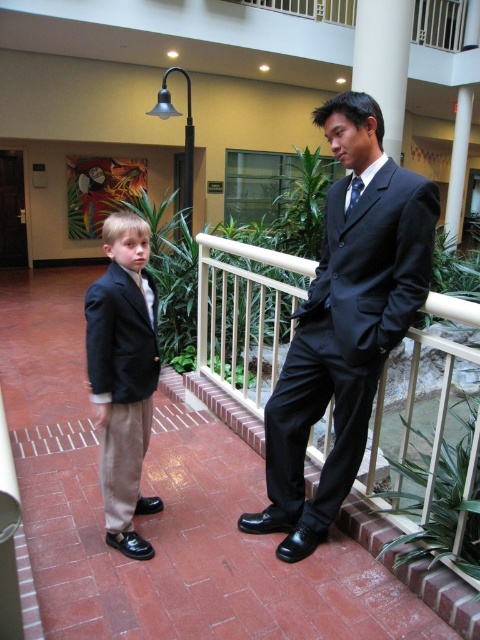
Question: Among these objects, which one is farthest from the camera?

Choices:
 (A) matte black suit at left
 (B) blue silk tie at center

Answer: (A)

Question: Can you confirm if matte black suit at left is bigger than blue silk tie at center?

Choices:
 (A) yes
 (B) no

Answer: (A)

Question: Does matte black suit at center appear under blue silk tie at center?

Choices:
 (A) yes
 (B) no

Answer: (A)

Question: Which is farther from the blue silk tie at center?

Choices:
 (A) matte black suit at center
 (B) matte black suit at left

Answer: (B)

Question: Is matte black suit at left in front of blue silk tie at center?

Choices:
 (A) no
 (B) yes

Answer: (A)

Question: Which of the following is the farthest from the observer?

Choices:
 (A) (418, 282)
 (B) (113, 406)

Answer: (B)